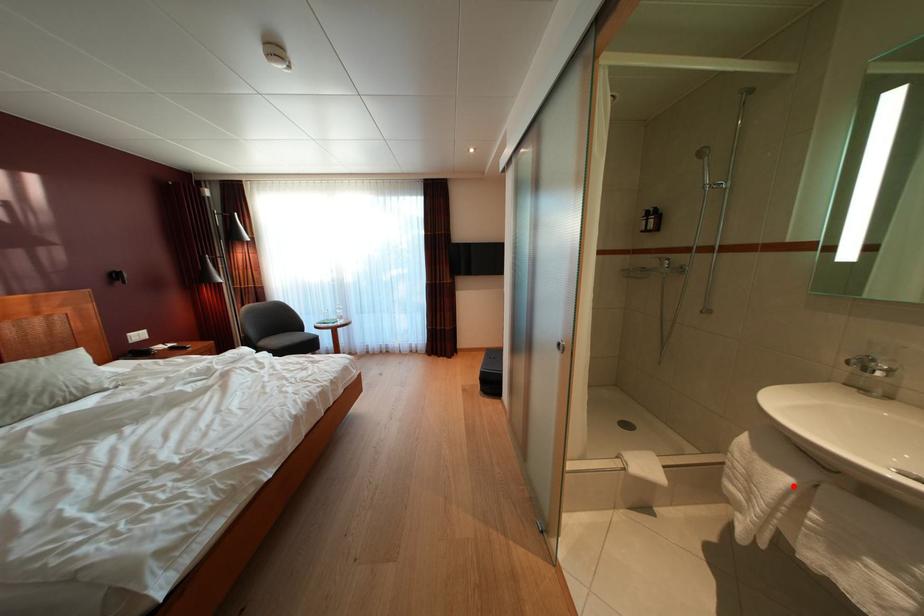
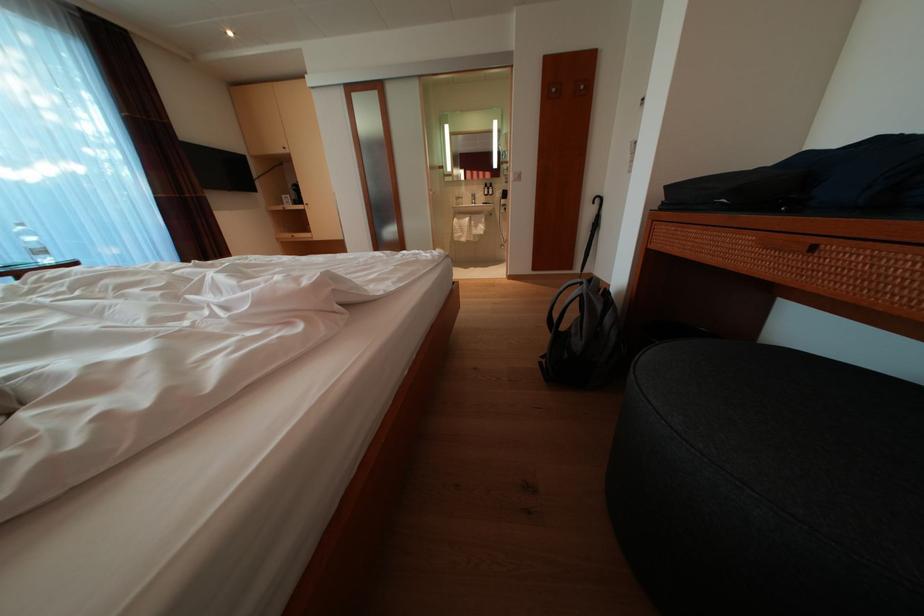
In the second image, find the point that corresponds to the highlighted location in the first image.

(476, 225)